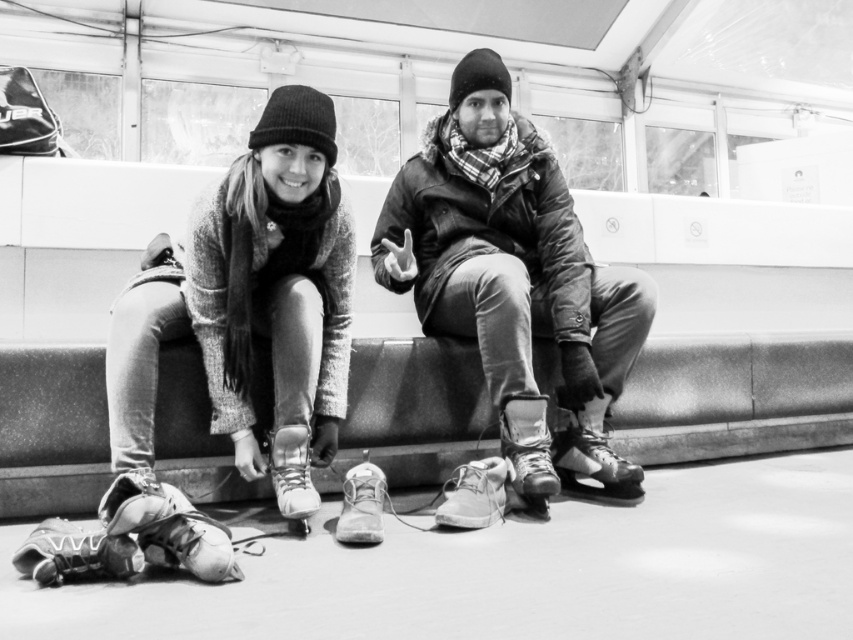
You are a photographer setting up a shoot at the ice skating rink. You notice the matte black jacket at center and the shiny leather boot at lower center. Which object is covering part of the other?

The matte black jacket at center is positioned over the shiny leather boot at lower center, so the jacket is covering part of the boot.

You are standing in front of the ice skating rink bench and want to know which object is higher between the matte black jacket at center and the shiny leather boot at lower center. Can you tell me?

The matte black jacket at center is much taller than the shiny leather boot at lower center.

You are a photographer standing in front of the ice rink. You notice two items on the ground near the woman on the left. Which item is closer to the camera, the leather skate at lower left or the leather shoe at lower center?

The leather skate at lower left is positioned under the leather shoe at lower center, meaning the shoe is closer to the camera.